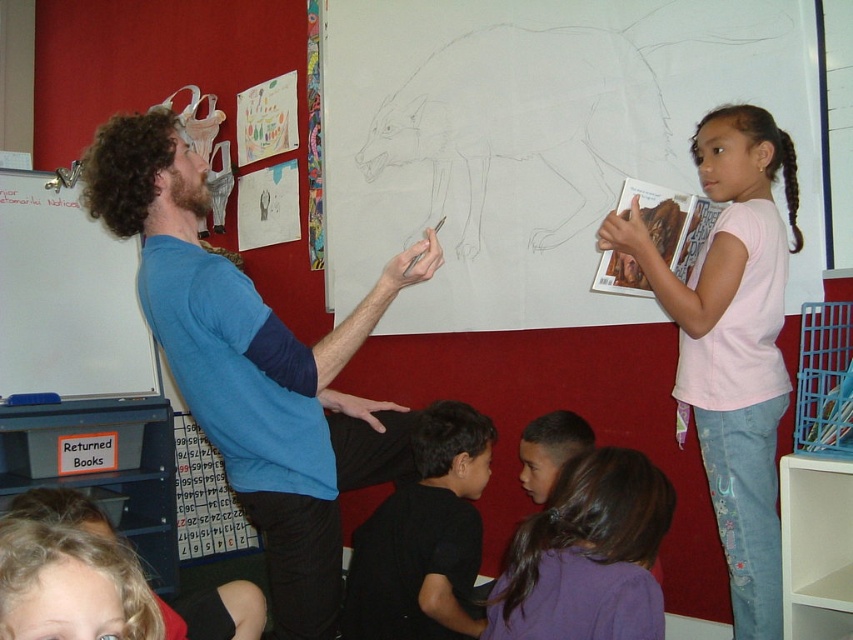
You are a teacher in the classroom and want to distribute stickers to the children. You have two items in your hand, the purple fabric hair at lower center and the black matte shirt at lower center. Which item is narrower so you can decide where to place the stickers?

The purple fabric hair at lower center has a lesser width compared to the black matte shirt at lower center, so it is narrower. You can place the stickers on the purple fabric hair at lower center.

You are a student in the classroom and want to determine which point is closer to you. The points are point [508,285] and point [735,477]. Which point is closer to you?

Point [508,285] is closer to you because it is further to the viewer than point [735,477].